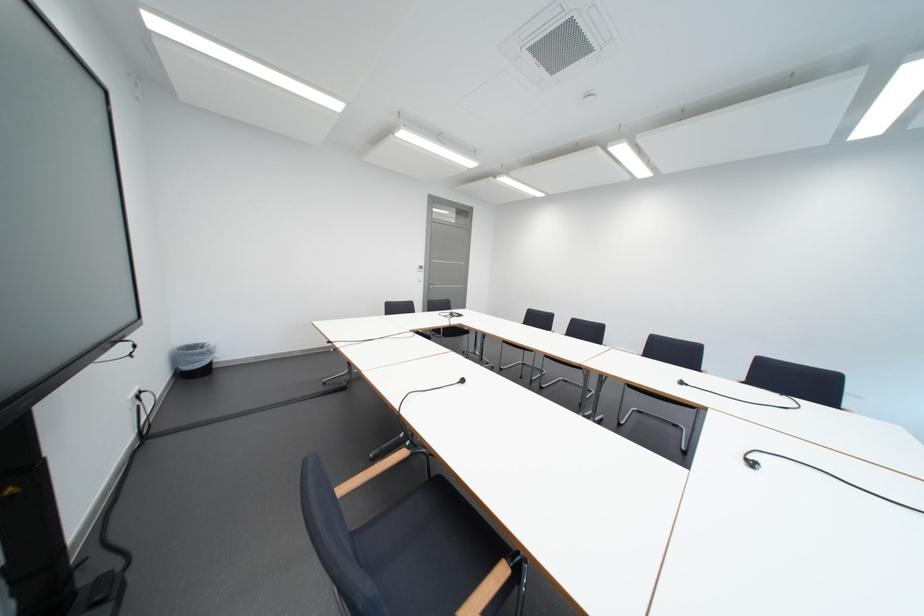
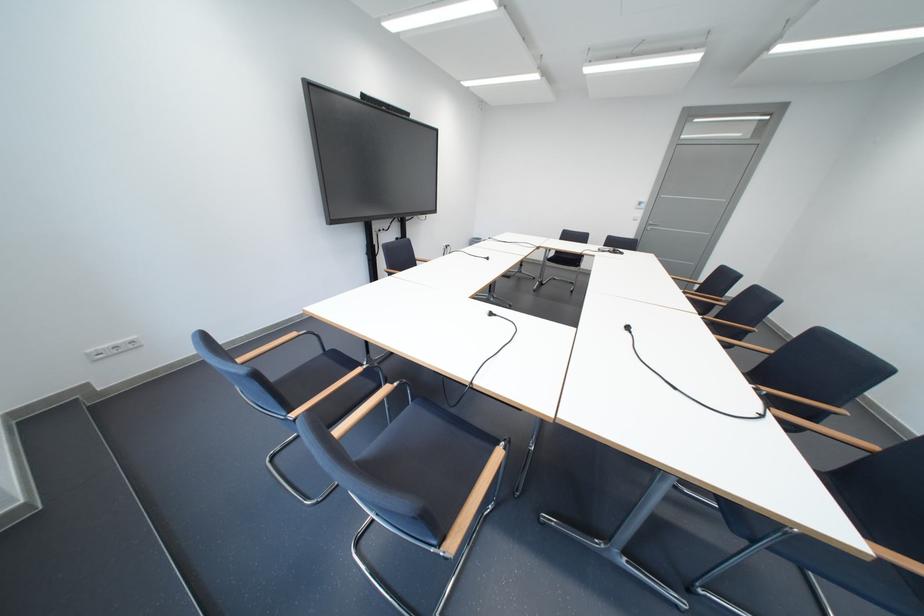
Locate, in the second image, the point that corresponds to [442,286] in the first image.

(660, 227)